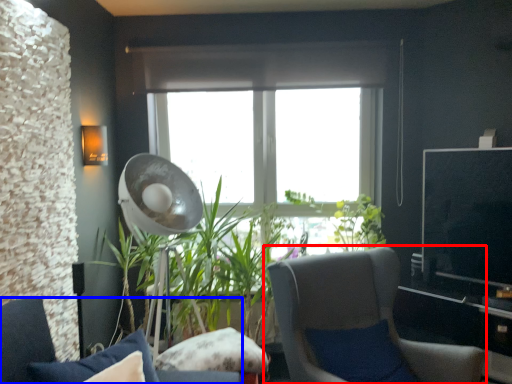
Question: Which point is further to the camera, chair (highlighted by a red box) or chair (highlighted by a blue box)?

Choices:
 (A) chair
 (B) chair

Answer: (A)